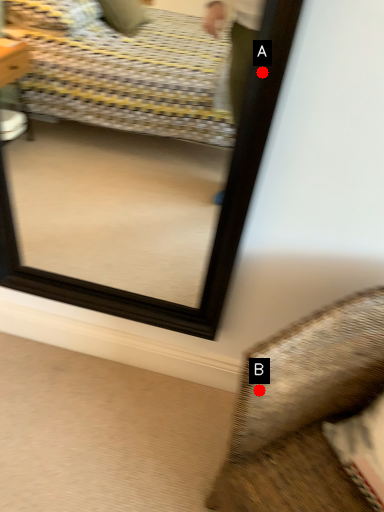
Question: Two points are circled on the image, labeled by A and B beside each circle. Which point is closer to the camera?

Choices:
 (A) A is closer
 (B) B is closer

Answer: (A)